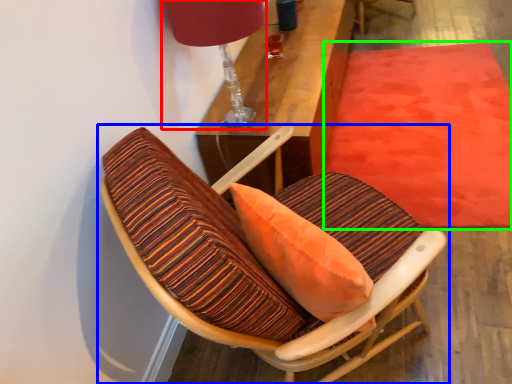
Question: Which object is positioned farthest from table lamp (highlighted by a red box)? Select from chair (highlighted by a blue box) and mat (highlighted by a green box).

Choices:
 (A) chair
 (B) mat

Answer: (B)